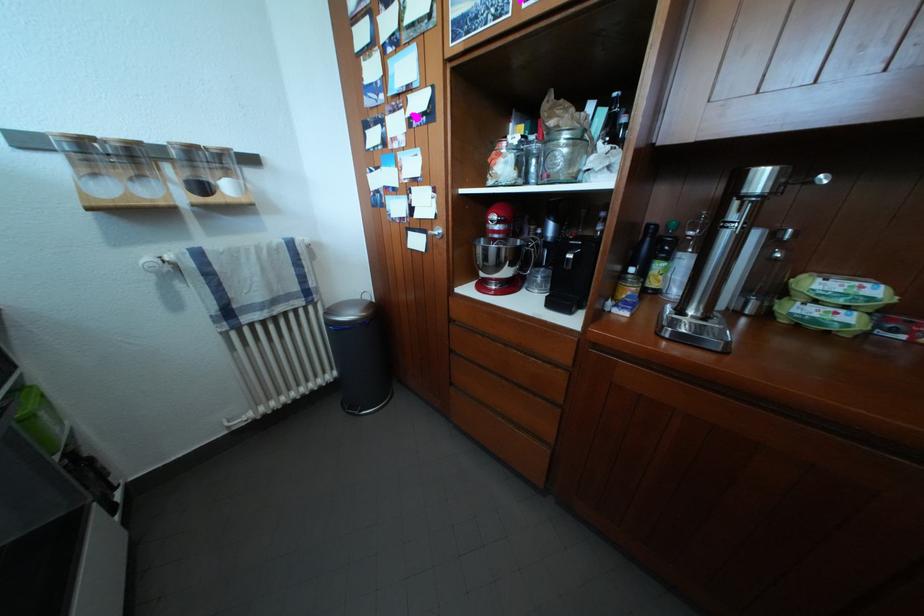
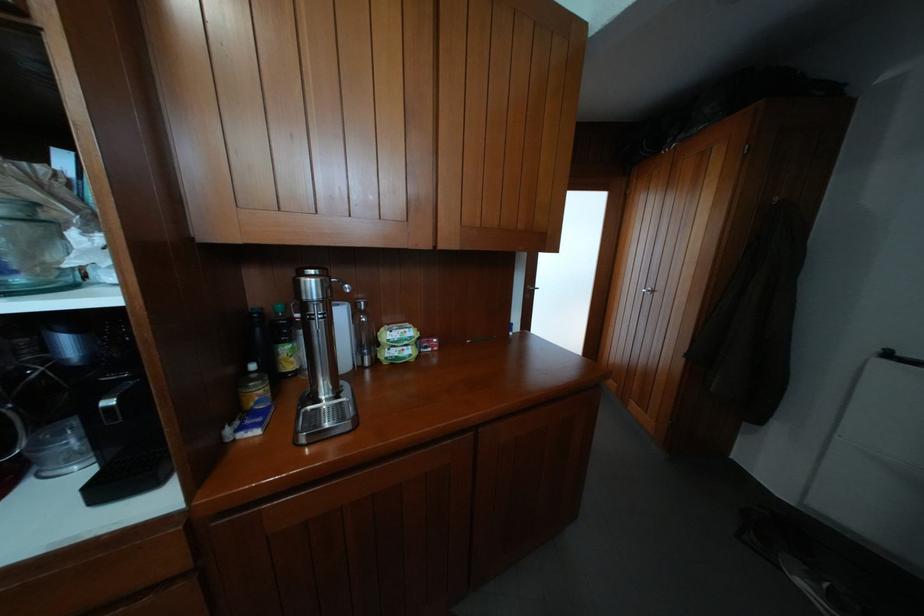
In the second image, find the point that corresponds to the point at 658,246 in the first image.

(266, 334)